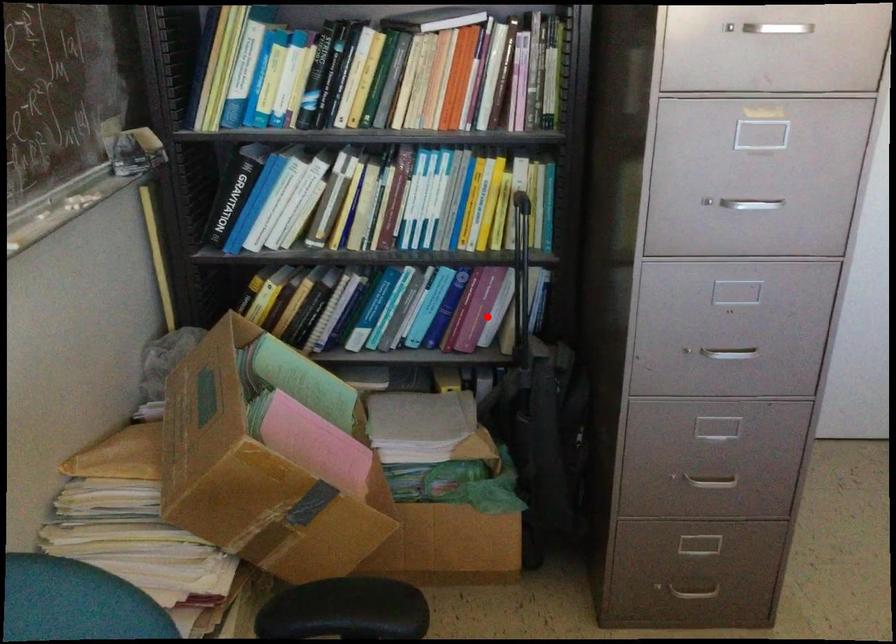
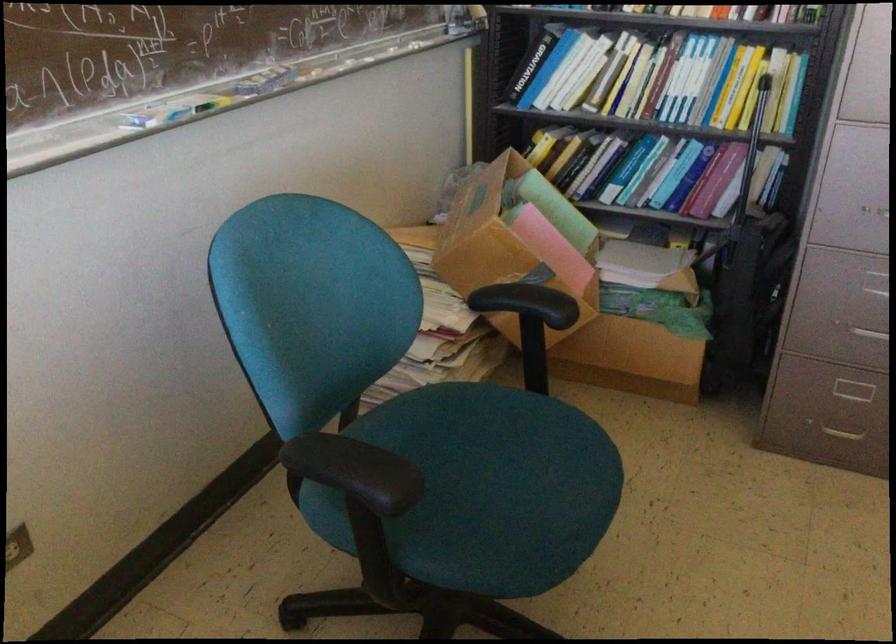
In the second image, find the point that corresponds to the highlighted location in the first image.

(722, 187)